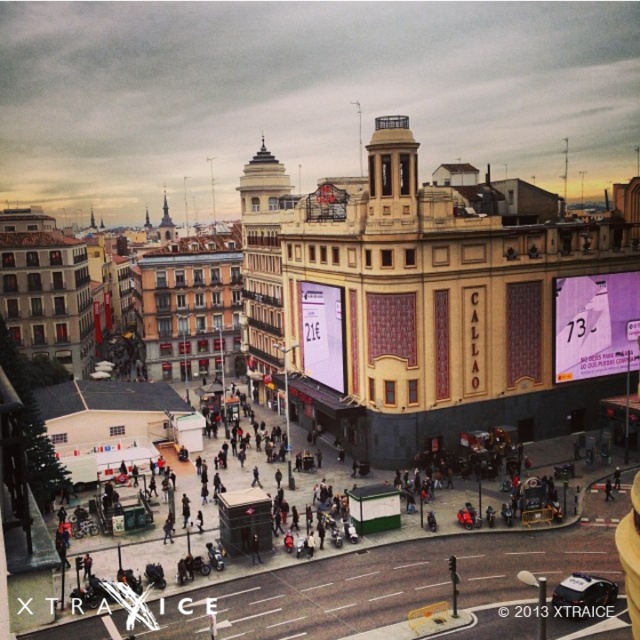
You are a drone operator tasked with capturing aerial footage of the white textured building at center and the matte purple billboard at center. Based on their positions, which object should you focus on first to ensure both are in frame without moving the drone?

The white textured building at center is located above the matte purple billboard at center, so you should focus on the white textured building at center first to ensure both are in frame without moving the drone.